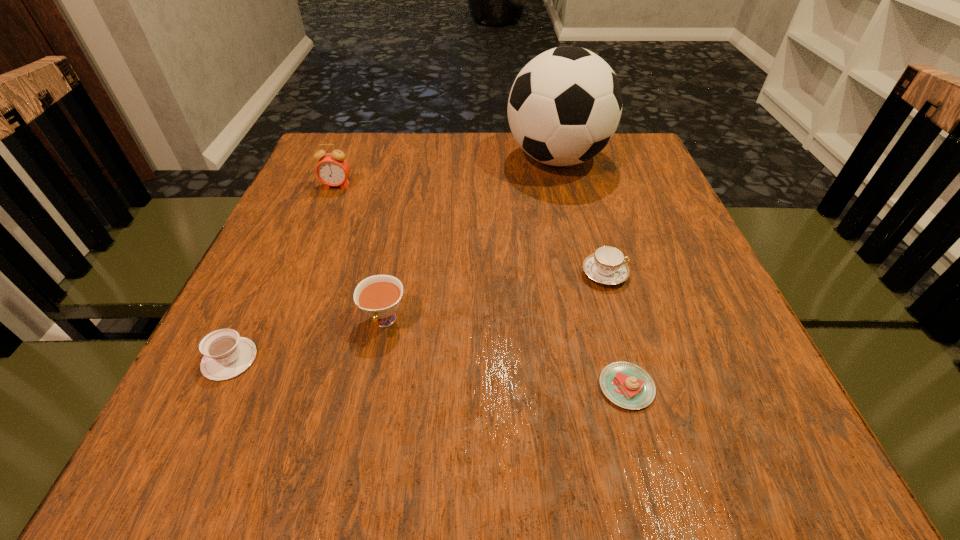
Where is `vacant area at the near edge of the desktop`? The image size is (960, 540). vacant area at the near edge of the desktop is located at coordinates (660, 444).

The image size is (960, 540). Find the location of `free point at the left edge`. free point at the left edge is located at coordinates (282, 356).

I want to click on vacant region at the right edge of the desktop, so click(x=647, y=191).

Image resolution: width=960 pixels, height=540 pixels. In the image, there is a desktop. Identify the location of vacant space at the near left corner. (169, 452).

Locate an element on the screen. vacant space at the far right corner of the desktop is located at coordinates (600, 164).

Where is `vacant area that lies between the tallest teacup and the alarm clock`? Image resolution: width=960 pixels, height=540 pixels. vacant area that lies between the tallest teacup and the alarm clock is located at coordinates (361, 254).

Identify the location of free space between the shortest object and the fourth shortest object. This screenshot has width=960, height=540. (505, 354).

You are a GUI agent. You are given a task and a screenshot of the screen. Output one action in this format:
    pyautogui.click(x=<x>, y=<y>)
    Task: Click on the blank region between the tallest teacup and the shortest object
    
    Given the screenshot: What is the action you would take?
    pyautogui.click(x=505, y=354)

This screenshot has height=540, width=960. Identify the location of vacant area between the alarm clock and the leftmost teacup. (283, 273).

Find the location of a particular element. vacant area between the farthest teacup and the second tallest object is located at coordinates (470, 230).